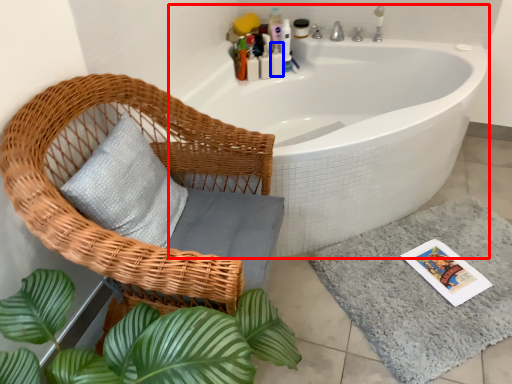
Question: Which point is closer to the camera, bathtub (highlighted by a red box) or toiletry (highlighted by a blue box)?

Choices:
 (A) bathtub
 (B) toiletry

Answer: (A)